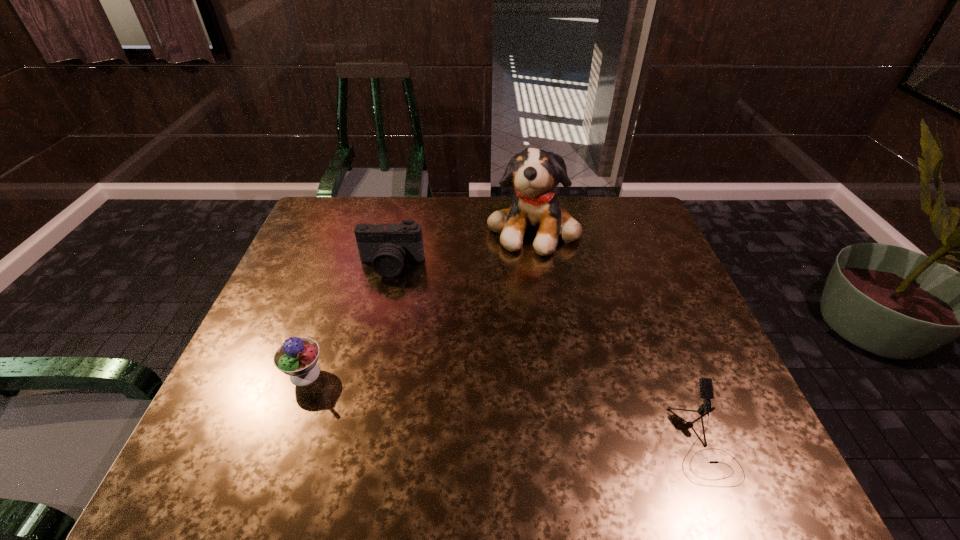
Where is `free space between the icecream and the nearest object`? free space between the icecream and the nearest object is located at coordinates (504, 408).

Where is `empty location between the third farthest object and the tallest object`? The height and width of the screenshot is (540, 960). empty location between the third farthest object and the tallest object is located at coordinates (419, 301).

Find the location of `free space between the second object from right to left and the nearest object`. free space between the second object from right to left and the nearest object is located at coordinates (617, 335).

Find the location of a particular element. This screenshot has height=540, width=960. vacant space in between the tallest object and the third farthest object is located at coordinates (419, 301).

You are a GUI agent. You are given a task and a screenshot of the screen. Output one action in this format:
    pyautogui.click(x=<x>, y=<y>)
    Task: Click on the free space between the icecream and the nearest object
    
    Given the screenshot: What is the action you would take?
    pyautogui.click(x=504, y=408)

Locate an element on the screen. free spot between the rightmost object and the camera is located at coordinates (547, 354).

Find the location of a particular element. The width and height of the screenshot is (960, 540). empty space between the third object from left to right and the camera is located at coordinates (462, 246).

Where is `free space between the second object from right to left and the rightmost object`? free space between the second object from right to left and the rightmost object is located at coordinates (617, 335).

Image resolution: width=960 pixels, height=540 pixels. I want to click on vacant area that lies between the camera and the third object from left to right, so click(x=462, y=246).

Find the location of a particular element. blank region between the microphone and the tallest object is located at coordinates (617, 335).